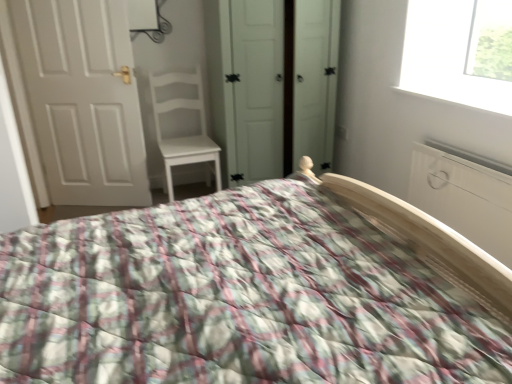
Question: Considering the relative sizes of white matte wardrobe at center and white matte radiator at right in the image provided, is white matte wardrobe at center thinner than white matte radiator at right?

Choices:
 (A) no
 (B) yes

Answer: (A)

Question: Is white matte wardrobe at center to the left of white matte radiator at right from the viewer's perspective?

Choices:
 (A) yes
 (B) no

Answer: (A)

Question: From the image's perspective, is white matte wardrobe at center on white matte radiator at right?

Choices:
 (A) yes
 (B) no

Answer: (A)

Question: Does white matte wardrobe at center have a greater height compared to white matte radiator at right?

Choices:
 (A) yes
 (B) no

Answer: (A)

Question: Considering the relative sizes of white matte wardrobe at center and white matte radiator at right in the image provided, is white matte wardrobe at center shorter than white matte radiator at right?

Choices:
 (A) yes
 (B) no

Answer: (B)

Question: Is white matte wardrobe at center placed right next to white matte radiator at right?

Choices:
 (A) yes
 (B) no

Answer: (B)

Question: Is white matte door at left closer to camera compared to white matte chair at center?

Choices:
 (A) yes
 (B) no

Answer: (A)

Question: Is white matte door at left located outside white matte chair at center?

Choices:
 (A) no
 (B) yes

Answer: (B)

Question: From a real-world perspective, does white matte door at left stand above white matte chair at center?

Choices:
 (A) no
 (B) yes

Answer: (B)

Question: From the image's perspective, is white matte door at left below white matte chair at center?

Choices:
 (A) yes
 (B) no

Answer: (B)

Question: Can you confirm if white matte door at left is positioned to the left of white matte chair at center?

Choices:
 (A) no
 (B) yes

Answer: (B)

Question: Does white matte door at left have a lesser height compared to white matte chair at center?

Choices:
 (A) yes
 (B) no

Answer: (B)

Question: Is white matte wardrobe at center wider than white matte chair at center?

Choices:
 (A) yes
 (B) no

Answer: (A)